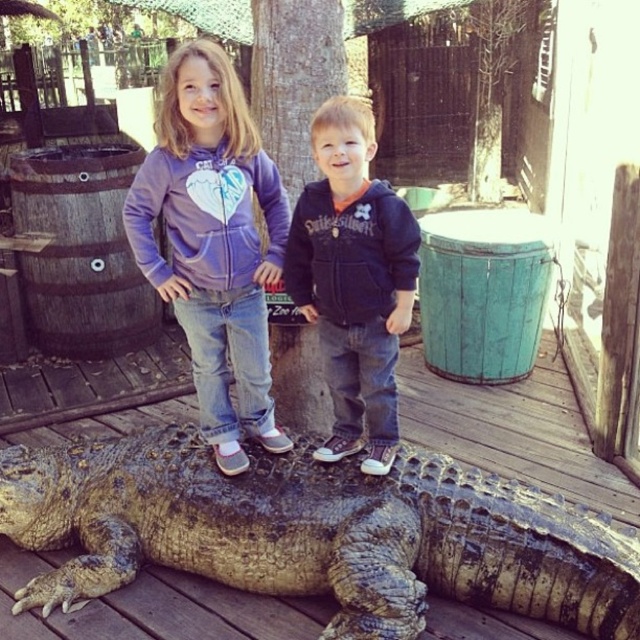
Consider the image. You are a photographer standing at the point marked by the coordinate point (212, 243). You want to take a photo of the purple fleece hoodie at center and the boy in dark blue hoodie on the right. Which direction should you move to frame both subjects in your shot?

Since the point (212, 243) marks the purple fleece hoodie at center, you should move to the right to include the boy in dark blue hoodie on the right in your frame.

In the scene shown: You are a photographer trying to capture a photo of the leathery brown crocodile at center. The camera you are using has a 50mm lens with a field of view of 46 degrees. The camera is positioned at point A, which is 5 meters away from the crocodile. The camera can only focus on objects within a 30 degree angle from its center axis. Is the crocodile within the camera focus range?

The crocodile is at point [316,532]. Since the camera is positioned at point A 5 meters away, and the focus range is within 30 degrees from the center axis, the crocodile is within the focus range as its position falls within the 30 degree angle.